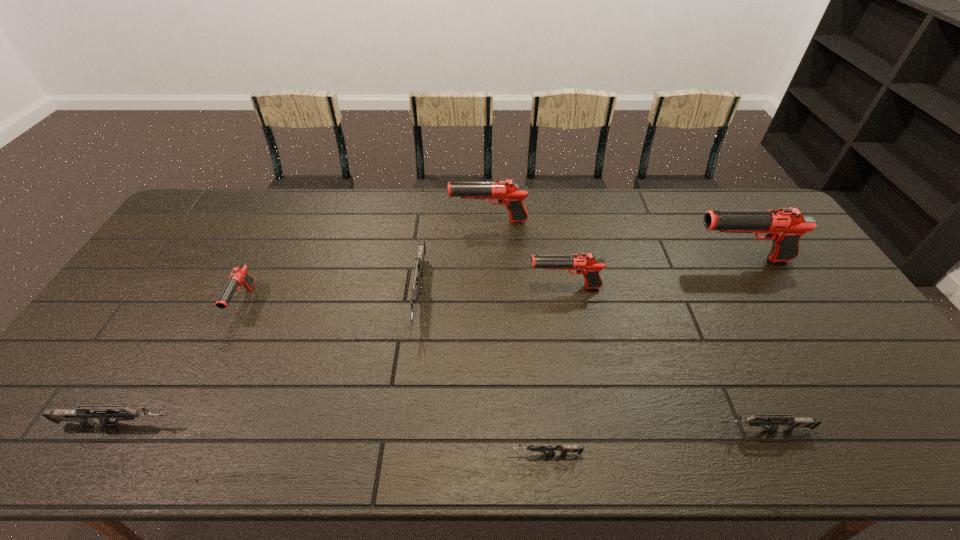
The image size is (960, 540). What are the coordinates of `vacant area that lies between the third object from left to right and the seventh shortest object` in the screenshot? It's located at [454, 258].

Identify the location of vacant space that is in between the sixth object from right to left and the second shortest object. This screenshot has width=960, height=540. (591, 362).

This screenshot has height=540, width=960. I want to click on object that is the third closest one to the farthest black gun, so 785,226.

Locate which object is the fifth closest to the smallest black gun. Please provide its 2D coordinates. Your answer should be formatted as a tuple, i.e. [(x, y)], where the tuple contains the x and y coordinates of a point satisfying the conditions above.

[(587, 264)]

Identify which gun is located as the second nearest to the leftmost black gun. Please provide its 2D coordinates. Your answer should be formatted as a tuple, i.e. [(x, y)], where the tuple contains the x and y coordinates of a point satisfying the conditions above.

[(419, 260)]

Locate an element on the screen. This screenshot has height=540, width=960. the seventh closest gun relative to the third smallest grey gun is located at coordinates (785, 226).

Where is `black gun that is the closest to the shortest object`? The width and height of the screenshot is (960, 540). black gun that is the closest to the shortest object is located at coordinates (587, 264).

Locate which black gun is the second closest to the third smallest grey gun. Please provide its 2D coordinates. Your answer should be formatted as a tuple, i.e. [(x, y)], where the tuple contains the x and y coordinates of a point satisfying the conditions above.

[(508, 193)]

Locate which grey gun ranks second in proximity to the nearest grey gun. Please provide its 2D coordinates. Your answer should be formatted as a tuple, i.e. [(x, y)], where the tuple contains the x and y coordinates of a point satisfying the conditions above.

[(419, 260)]

Select which grey gun appears as the closest to the third smallest grey gun. Please provide its 2D coordinates. Your answer should be formatted as a tuple, i.e. [(x, y)], where the tuple contains the x and y coordinates of a point satisfying the conditions above.

[(419, 260)]